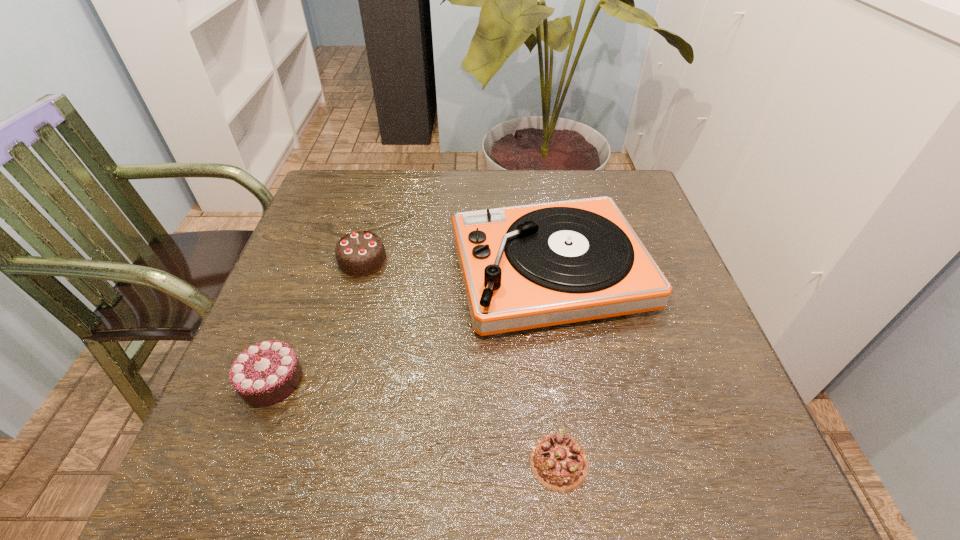
This screenshot has width=960, height=540. I want to click on empty space that is in between the shortest chocolate cake and the second shortest chocolate cake, so click(416, 421).

Identify the location of vacant area that lies between the shortest object and the farthest chocolate cake. (461, 361).

The width and height of the screenshot is (960, 540). What are the coordinates of `vacant space that's between the second shortest object and the tallest object` in the screenshot? It's located at (411, 325).

At what (x,y) coordinates should I click in order to perform the action: click on vacant region between the shortest chocolate cake and the tallest object. Please return your answer as a coordinate pair (x, y). Looking at the image, I should click on pos(555,366).

At what (x,y) coordinates should I click in order to perform the action: click on free spot between the second nearest chocolate cake and the farthest chocolate cake. Please return your answer as a coordinate pair (x, y). Looking at the image, I should click on (317, 320).

Identify the location of unoccupied position between the rightmost chocolate cake and the farthest chocolate cake. This screenshot has height=540, width=960. (461, 361).

This screenshot has width=960, height=540. I want to click on free point between the farthest chocolate cake and the rightmost chocolate cake, so click(461, 361).

You are a GUI agent. You are given a task and a screenshot of the screen. Output one action in this format:
    pyautogui.click(x=<x>, y=<y>)
    Task: Click on the free space between the third tallest object and the nearest chocolate cake
    
    Given the screenshot: What is the action you would take?
    pyautogui.click(x=416, y=421)

This screenshot has width=960, height=540. What are the coordinates of `vacant area between the tallest object and the rightmost chocolate cake` in the screenshot? It's located at (555, 366).

The image size is (960, 540). What are the coordinates of `free space between the tallest object and the third tallest object` in the screenshot? It's located at (411, 325).